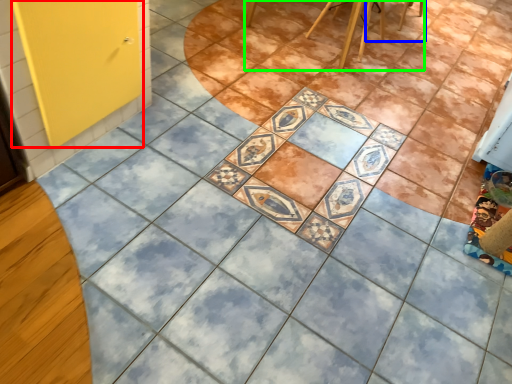
Question: Which object is the farthest from screen door (highlighted by a red box)? Choose among these: chair (highlighted by a blue box) or furniture (highlighted by a green box).

Choices:
 (A) chair
 (B) furniture

Answer: (A)